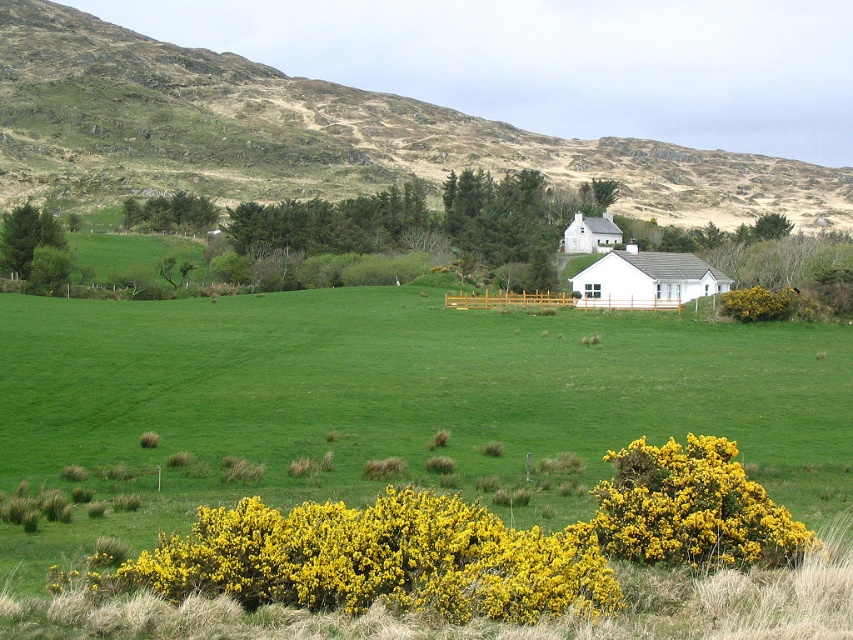
Question: Does white smooth house at center appear under white smooth house at center-right?

Choices:
 (A) no
 (B) yes

Answer: (B)

Question: Which point is closer to the camera?

Choices:
 (A) (381, 177)
 (B) (664, 474)

Answer: (B)

Question: Does white smooth house at center have a larger size compared to white smooth house at center-right?

Choices:
 (A) yes
 (B) no

Answer: (A)

Question: Does green grassy hillside at upper center have a greater width compared to yellow fluffy bush at lower right?

Choices:
 (A) no
 (B) yes

Answer: (B)

Question: Which point is closer to the camera taking this photo?

Choices:
 (A) (614, 163)
 (B) (677, 253)
 (C) (648, 493)
 (D) (22, 266)

Answer: (C)

Question: Which of these objects is positioned closest to the green grassy hillside at upper center?

Choices:
 (A) white smooth house at center-right
 (B) yellow fluffy bush at lower right
 (C) white smooth house at center

Answer: (A)